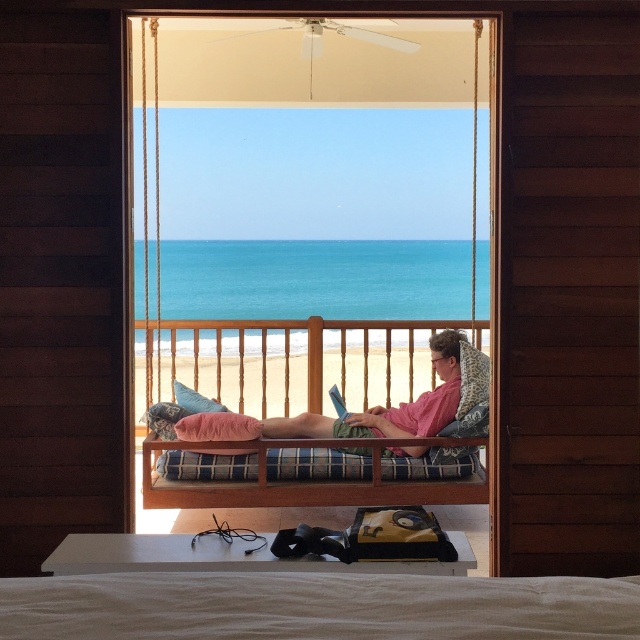
Question: Which of the following is the closest to the observer?

Choices:
 (A) plaid fabric bed at center
 (B) teal fabric pillow at center
 (C) wooden cushioned swing at center

Answer: (C)

Question: Based on their relative distances, which object is nearer to the wooden cushioned swing at center?

Choices:
 (A) plaid fabric bed at center
 (B) teal fabric pillow at center

Answer: (A)

Question: Can you confirm if wooden cushioned swing at center is positioned above plaid fabric bed at center?

Choices:
 (A) no
 (B) yes

Answer: (B)

Question: Estimate the real-world distances between objects in this image. Which object is farther from the teal fabric pillow at center?

Choices:
 (A) wooden cushioned swing at center
 (B) plaid fabric bed at center

Answer: (A)

Question: Does wooden cushioned swing at center appear on the right side of teal fabric pillow at center?

Choices:
 (A) no
 (B) yes

Answer: (A)

Question: Does wooden cushioned swing at center have a larger size compared to teal fabric pillow at center?

Choices:
 (A) no
 (B) yes

Answer: (B)